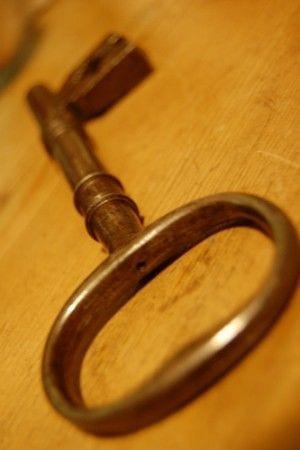
At what (x,y) coordinates should I click in order to perform the action: click on darker stain in wood. Please return your answer as a coordinate pair (x, y). Image resolution: width=300 pixels, height=450 pixels. Looking at the image, I should click on (194, 285).